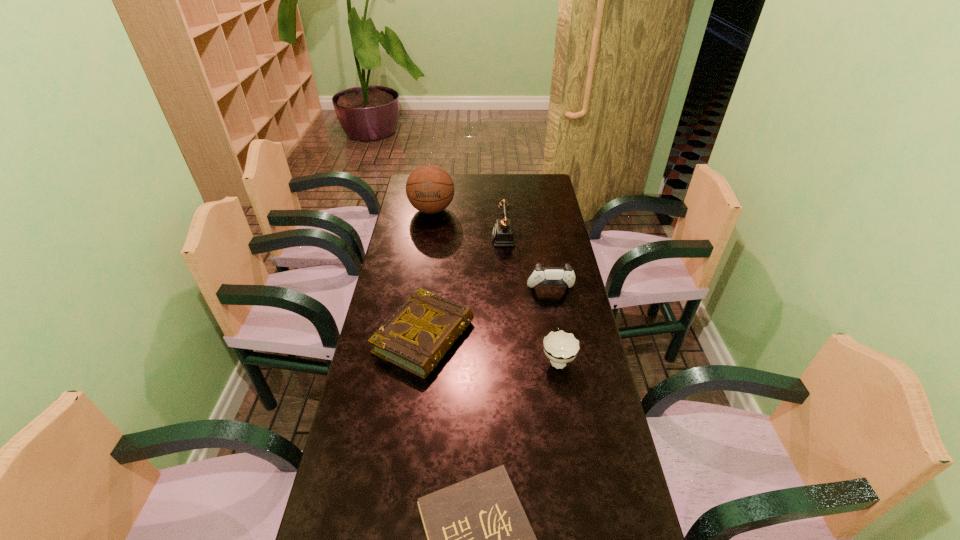
Identify the location of free space located on the front of the telephone at the rotary dial. The image size is (960, 540). (406, 239).

Where is `free space located 0.130m on the front of the telephone at the rotary dial`? free space located 0.130m on the front of the telephone at the rotary dial is located at coordinates (461, 239).

What are the coordinates of `free space located on the front-facing side of the control` in the screenshot? It's located at (558, 329).

The height and width of the screenshot is (540, 960). In order to click on free point located on the side of the third shortest object with the handle in this screenshot , I will do `click(542, 269)`.

Locate an element on the screen. The height and width of the screenshot is (540, 960). blank space located 0.200m on the side of the third shortest object with the handle is located at coordinates (547, 299).

Locate an element on the screen. vacant space located 0.240m on the side of the third shortest object with the handle is located at coordinates (546, 292).

Locate an element on the screen. This screenshot has height=540, width=960. vacant region located on the right of the farther hardback book is located at coordinates (575, 338).

This screenshot has height=540, width=960. In order to click on object at the far edge in this screenshot , I will do `click(430, 189)`.

Where is `basketball situated at the left edge`? This screenshot has height=540, width=960. basketball situated at the left edge is located at coordinates (430, 189).

Identify the location of hardback book that is at the left edge. The width and height of the screenshot is (960, 540). (416, 338).